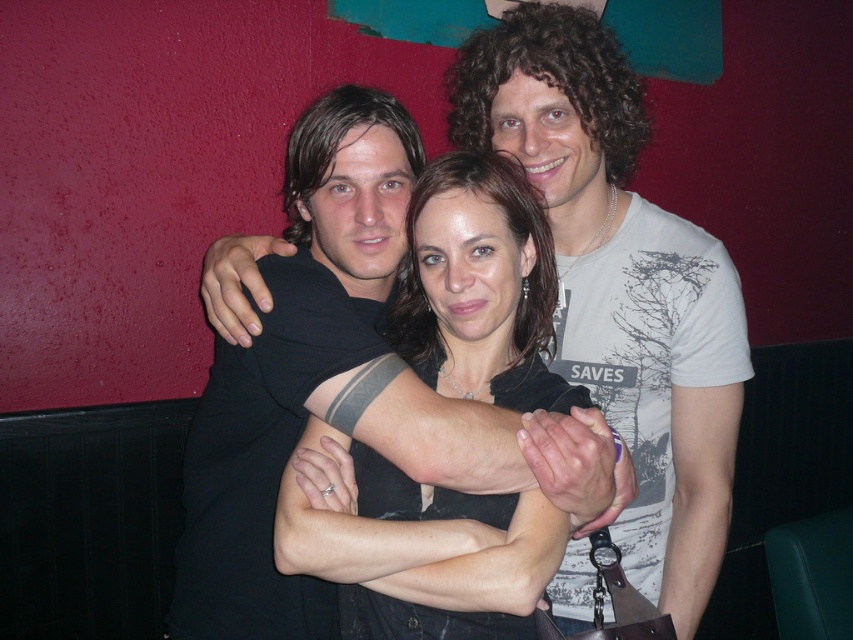
Question: Which point is farther from the camera taking this photo?

Choices:
 (A) 674,273
 (B) 514,385

Answer: (A)

Question: Where is black matte shirt at center located in relation to matte black shirt at center in the image?

Choices:
 (A) below
 (B) above

Answer: (B)

Question: Is black matte shirt at center further to the viewer compared to matte black shirt at center?

Choices:
 (A) no
 (B) yes

Answer: (B)

Question: Does black matte shirt at center have a greater width compared to matte black shirt at center?

Choices:
 (A) no
 (B) yes

Answer: (B)

Question: Among these points, which one is nearest to the camera?

Choices:
 (A) (570, 240)
 (B) (473, 332)

Answer: (B)